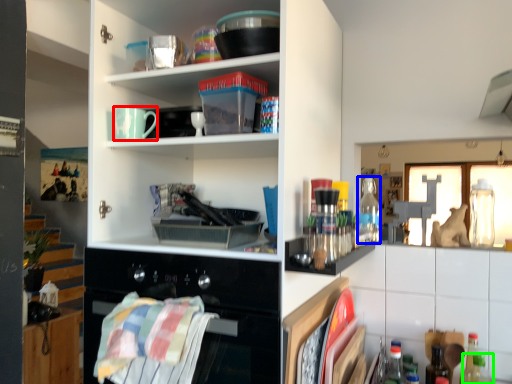
Question: Which object is positioned farthest from mug (highlighted by a red box)? Select from bottle (highlighted by a blue box) and bottle (highlighted by a green box).

Choices:
 (A) bottle
 (B) bottle

Answer: (B)